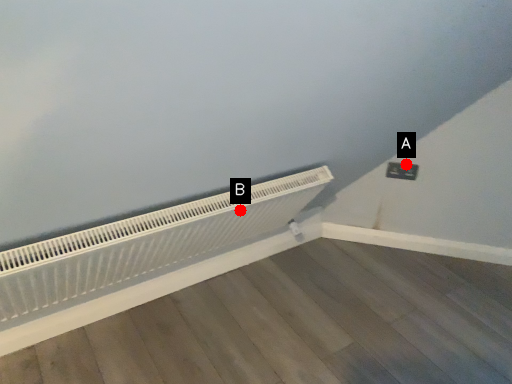
Question: Two points are circled on the image, labeled by A and B beside each circle. Which of the following is the farthest from the observer?

Choices:
 (A) A is further
 (B) B is further

Answer: (A)